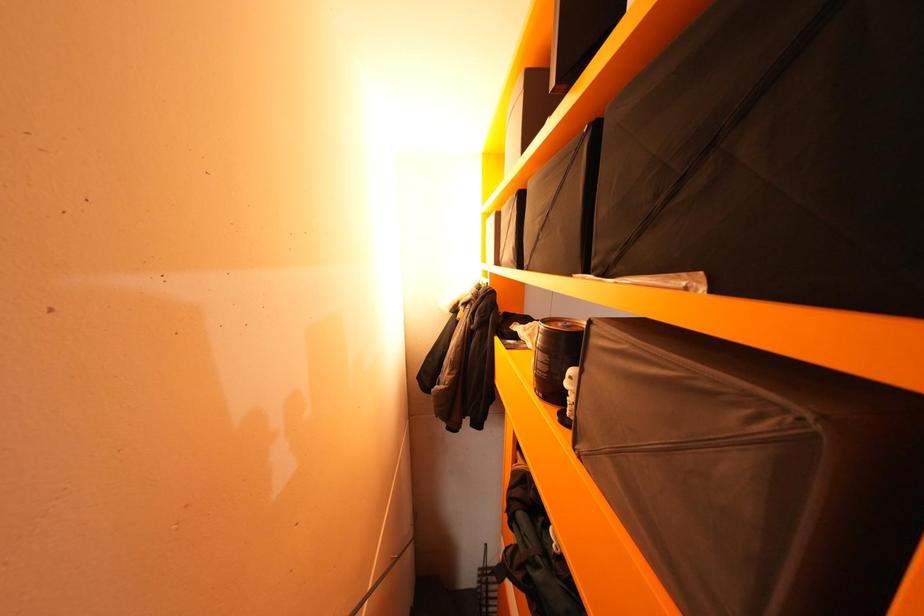
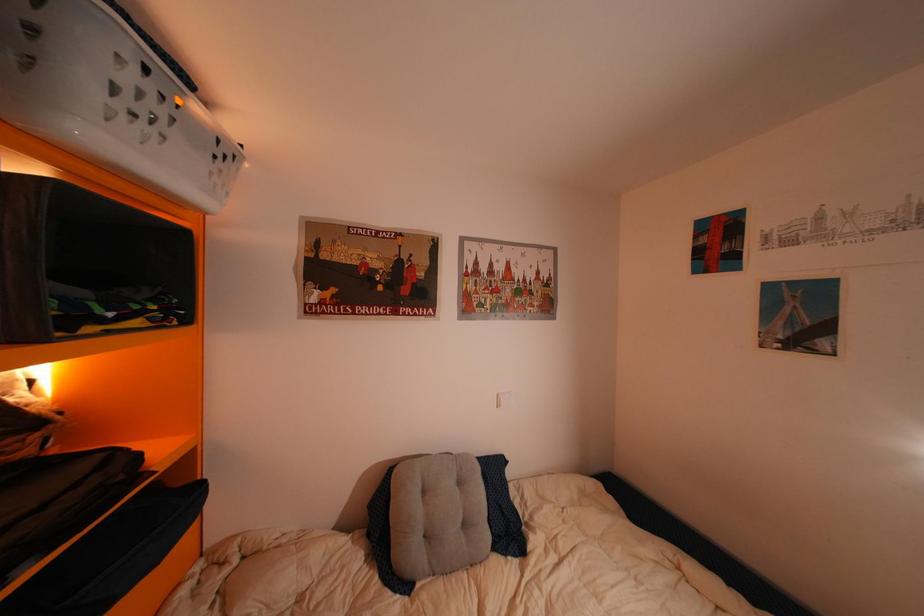
The images are taken continuously from a first-person perspective. In which direction are you moving?

The cameraman moved toward right, forward.